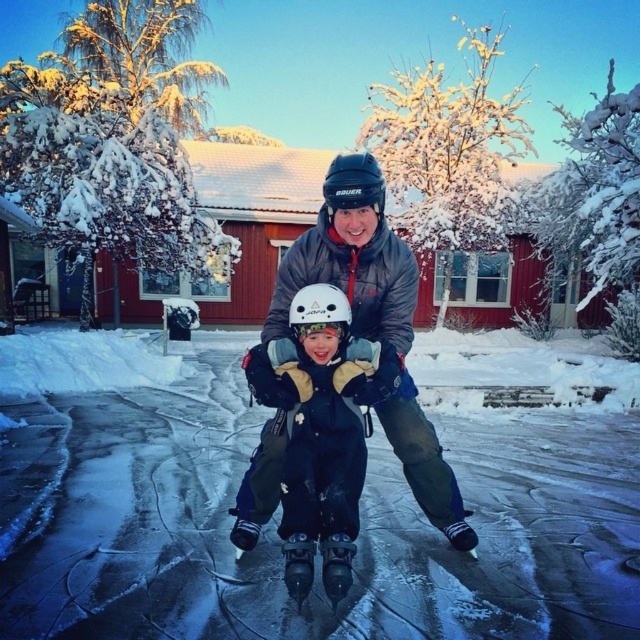
Question: Based on their relative distances, which object is nearer to the white fluffy snow at center?

Choices:
 (A) dark blue fabric jacket at center
 (B) white matte helmet at center
 (C) black matte helmet at center

Answer: (A)

Question: Can you confirm if white fluffy snow at center is thinner than white matte helmet at center?

Choices:
 (A) no
 (B) yes

Answer: (A)

Question: Can you confirm if white fluffy snow at center is thinner than black matte helmet at center?

Choices:
 (A) yes
 (B) no

Answer: (B)

Question: Which point appears farthest from the camera in this image?

Choices:
 (A) (444, 419)
 (B) (330, 214)
 (C) (317, 301)

Answer: (A)

Question: Does white fluffy snow at center appear on the right side of black matte helmet at center?

Choices:
 (A) yes
 (B) no

Answer: (A)

Question: Which point appears closest to the camera in this image?

Choices:
 (A) (396, 429)
 (B) (465, 456)
 (C) (349, 154)

Answer: (C)